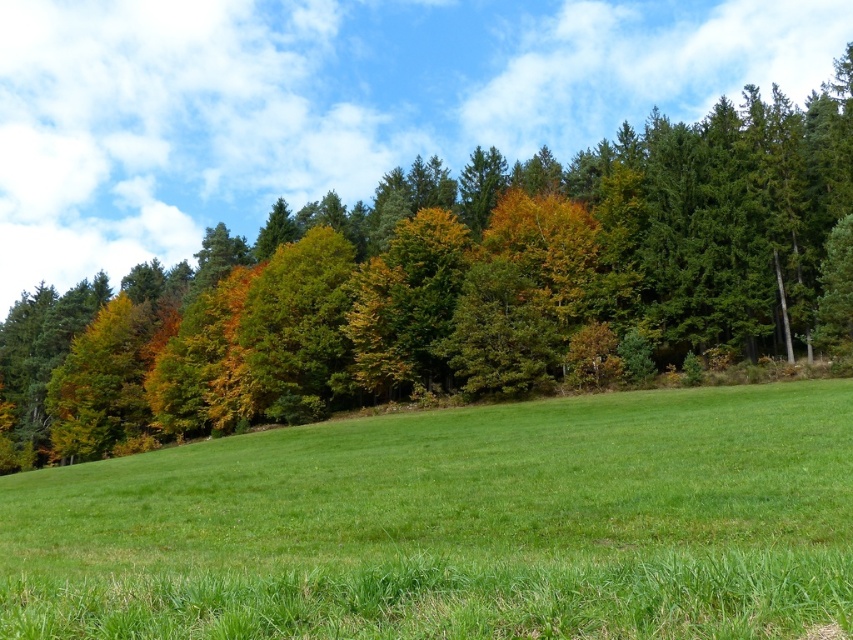
Is green grass at center wider than green leafy trees at upper center?

Incorrect, green grass at center's width does not surpass green leafy trees at upper center's.

Does green grass at center appear on the right side of green leafy trees at upper center?

Correct, you'll find green grass at center to the right of green leafy trees at upper center.

Where is `green grass at center`? This screenshot has width=853, height=640. green grass at center is located at coordinates (456, 525).

Image resolution: width=853 pixels, height=640 pixels. I want to click on green grass at center, so click(x=456, y=525).